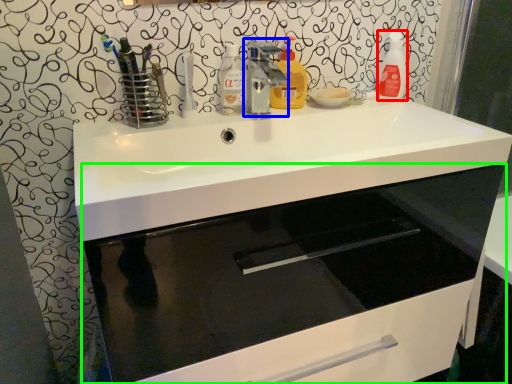
Question: Considering the real-world distances, which object is farthest from cleaning product (highlighted by a red box)? tap (highlighted by a blue box) or bathroom cabinet (highlighted by a green box)?

Choices:
 (A) tap
 (B) bathroom cabinet

Answer: (B)